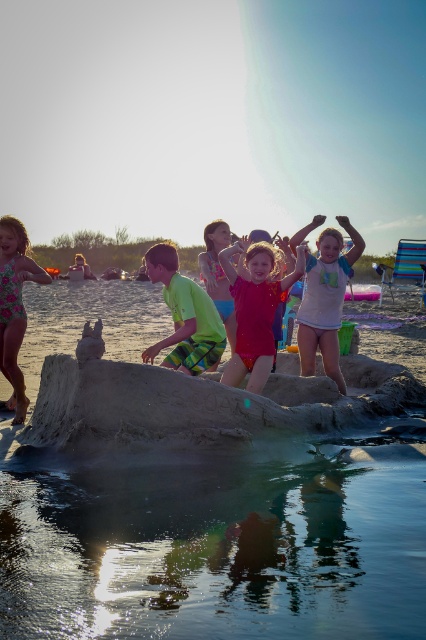
Question: Considering the relative positions of matte pink swimsuit at center and floral print swimsuit at left in the image provided, where is matte pink swimsuit at center located with respect to floral print swimsuit at left?

Choices:
 (A) left
 (B) right

Answer: (B)

Question: Which point appears farthest from the camera in this image?

Choices:
 (A) (354, 236)
 (B) (215, 250)
 (C) (8, 310)
 (D) (209, 355)

Answer: (B)

Question: Is the position of matte pink swimsuit at center more distant than that of white cotton shirt at center?

Choices:
 (A) yes
 (B) no

Answer: (B)

Question: Among these objects, which one is farthest from the camera?

Choices:
 (A) bright red fabric at center
 (B) green plaid shorts at center
 (C) clear water at sand center
 (D) floral print swimsuit at left

Answer: (A)

Question: Which point appears closest to the camera in this image?

Choices:
 (A) (20, 381)
 (B) (261, 276)

Answer: (B)

Question: Can you confirm if white cotton shirt at center is positioned below bright red fabric at center?

Choices:
 (A) yes
 (B) no

Answer: (A)